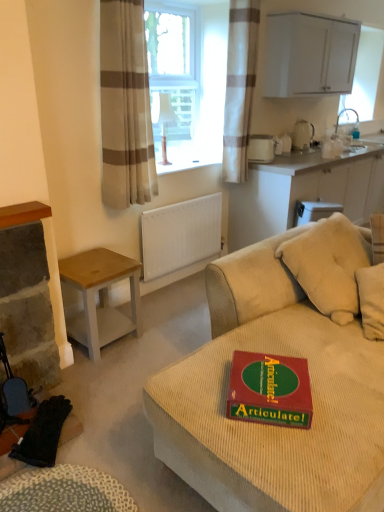
Identify the location of white glossy cabinet at upper right, which is the second cabinetry from bottom to top. The width and height of the screenshot is (384, 512). (309, 55).

Identify the location of beige striped curtain at upper center, marked as the 1th curtain in a front-to-back arrangement. This screenshot has height=512, width=384. (125, 106).

Describe the element at coordinates (239, 87) in the screenshot. The width and height of the screenshot is (384, 512). I see `beige striped curtain at upper right, the first curtain from the right` at that location.

Where is `white matte radiator at center`? white matte radiator at center is located at coordinates (180, 234).

Identify the location of silver metallic faucet at upper right. (344, 112).

Which point is more forward, (368, 411) or (314, 132)?

The point (368, 411) is closer to the camera.

In the image, is beige corduroy couch at center positioned in front of or behind white glossy kettle at upper right, the 2th appliance from the front?

Clearly, beige corduroy couch at center is in front of white glossy kettle at upper right, the 2th appliance from the front.

Is white glossy kettle at upper right, the 2th appliance when ordered from left to right, completely or partially inside beige corduroy couch at center?

No, white glossy kettle at upper right, the 2th appliance when ordered from left to right, is not surrounded by beige corduroy couch at center.

From the image's perspective, between light brown wood desk at left and silver metallic faucet at upper right, who is located below?

light brown wood desk at left.

Between light brown wood desk at left and silver metallic faucet at upper right, which one has larger size?

light brown wood desk at left is bigger.

Is there a large distance between light brown wood desk at left and silver metallic faucet at upper right?

light brown wood desk at left is far away from silver metallic faucet at upper right.

How distant is light brown wood desk at left from silver metallic faucet at upper right?

light brown wood desk at left and silver metallic faucet at upper right are 3.02 meters apart from each other.

Visually, is white glossy kettle at upper right, marked as the first appliance in a right-to-left arrangement, positioned to the left or to the right of beige corduroy couch at center?

Clearly, white glossy kettle at upper right, marked as the first appliance in a right-to-left arrangement, is on the right of beige corduroy couch at center in the image.

How far apart are white glossy kettle at upper right, marked as the first appliance in a right-to-left arrangement, and beige corduroy couch at center?

The distance of white glossy kettle at upper right, marked as the first appliance in a right-to-left arrangement, from beige corduroy couch at center is 8.93 feet.

Is white glossy kettle at upper right, acting as the first appliance starting from the back, not near beige corduroy couch at center?

Indeed, white glossy kettle at upper right, acting as the first appliance starting from the back, is not near beige corduroy couch at center.

Is beige corduroy couch at center inside white glossy kettle at upper right, the 2th appliance when ordered from left to right?

No, beige corduroy couch at center is not surrounded by white glossy kettle at upper right, the 2th appliance when ordered from left to right.

There is a light brown wood desk at left. Identify the location of the 2nd cabinetry above it (from a real-world perspective). This screenshot has width=384, height=512. (309, 55).

Is light brown wood desk at left not inside white glossy cabinet at upper right, which is the second cabinetry from bottom to top?

Yes.

Is light brown wood desk at left wider than white glossy cabinet at upper right, arranged as the first cabinetry when viewed from the top?

Yes.

How many degrees apart are the facing directions of light brown wood desk at left and white glossy cabinet at upper right, which is the second cabinetry from bottom to top?

The angular difference between light brown wood desk at left and white glossy cabinet at upper right, which is the second cabinetry from bottom to top, is 3.02 degrees.

From a real-world perspective, does beige corduroy couch at center sit lower than white matte cabinet at upper right, which ranks as the 2th cabinetry in top-to-bottom order?

No, from a real-world perspective, beige corduroy couch at center is not beneath white matte cabinet at upper right, which ranks as the 2th cabinetry in top-to-bottom order.

Between beige corduroy couch at center and white matte cabinet at upper right, which ranks as the 2th cabinetry in top-to-bottom order, which one is positioned in front?

beige corduroy couch at center.

Between beige corduroy couch at center and white matte cabinet at upper right, which ranks as the 2th cabinetry in top-to-bottom order, which one appears on the left side from the viewer's perspective?

Positioned to the left is beige corduroy couch at center.

Based on the photo, could you tell me if beige corduroy couch at center is turned towards white matte cabinet at upper right, which ranks as the 2th cabinetry in top-to-bottom order?

No, beige corduroy couch at center is not aimed at white matte cabinet at upper right, which ranks as the 2th cabinetry in top-to-bottom order.

Could you tell me if matte white lampshade at center is facing beige corduroy couch at center?

No.

This screenshot has width=384, height=512. Identify the location of lamp above the beige corduroy couch at center (from a real-world perspective). (164, 120).

How different are the orientations of matte white lampshade at center and beige corduroy couch at center in degrees?

matte white lampshade at center and beige corduroy couch at center are facing 91.2 degrees away from each other.

How far apart are beige striped curtain at upper center, the first curtain in the left-to-right sequence, and beige corduroy couch at center?

The distance of beige striped curtain at upper center, the first curtain in the left-to-right sequence, from beige corduroy couch at center is 4.42 feet.

Looking at this image, is beige striped curtain at upper center, marked as the 1th curtain in a front-to-back arrangement, bigger than beige corduroy couch at center?

No.

Which is in front, point (132, 26) or point (319, 337)?

The point (319, 337) is more forward.

At what (x,y) coordinates should I click in order to perform the action: click on curtain that is the 1st object located above the beige corduroy couch at center (from the image's perspective). Please return your answer as a coordinate pair (x, y). Looking at the image, I should click on tap(125, 106).

Where is `studio couch located on the left of white glossy kettle at upper right, acting as the first appliance starting from the back`? studio couch located on the left of white glossy kettle at upper right, acting as the first appliance starting from the back is located at coordinates (272, 425).

What are the coordinates of `desk that appears below the silver metallic faucet at upper right (from the image's perspective)` in the screenshot? It's located at (101, 297).

Estimate the real-world distances between objects in this image. Which object is closer to white matte radiator at center, white plastic container at upper center, placed as the first appliance when sorted from left to right, or white glossy cabinet at upper right, which is the second cabinetry from bottom to top?

The object closer to white matte radiator at center is white plastic container at upper center, placed as the first appliance when sorted from left to right.

When comparing their distances from beige striped curtain at upper right, arranged as the 1th curtain when viewed from the back, does white plastic container at upper center, marked as the second appliance in a right-to-left arrangement, or light brown wood desk at left seem further?

light brown wood desk at left lies further to beige striped curtain at upper right, arranged as the 1th curtain when viewed from the back, than the other object.

From the image, which object appears to be nearer to beige corduroy couch at center, silver metallic faucet at upper right or white glossy cabinet at upper right, which is the second cabinetry from bottom to top?

white glossy cabinet at upper right, which is the second cabinetry from bottom to top, lies closer to beige corduroy couch at center than the other object.

Considering their positions, is green cardboard game at center positioned further to white glossy cabinet at upper right, which is the second cabinetry from bottom to top, than matte white lampshade at center?

green cardboard game at center is further to white glossy cabinet at upper right, which is the second cabinetry from bottom to top.

Based on their spatial positions, is beige striped curtain at upper center, arranged as the 2th curtain when viewed from the back, or beige corduroy couch at center further from white glossy cabinet at upper right, which is the second cabinetry from bottom to top?

Among the two, beige corduroy couch at center is located further to white glossy cabinet at upper right, which is the second cabinetry from bottom to top.

Estimate the real-world distances between objects in this image. Which object is closer to matte white lampshade at center, silver metallic faucet at upper right or white plastic container at upper center, the 2th appliance in the back-to-front sequence?

The object closer to matte white lampshade at center is white plastic container at upper center, the 2th appliance in the back-to-front sequence.

Estimate the real-world distances between objects in this image. Which object is closer to white plastic container at upper center, placed as the first appliance when sorted from left to right, beige striped curtain at upper center, positioned as the second curtain in right-to-left order, or matte white lampshade at center?

matte white lampshade at center.

Estimate the real-world distances between objects in this image. Which object is closer to white plastic container at upper center, the 2th appliance in the back-to-front sequence, beige striped curtain at upper center, the first curtain in the left-to-right sequence, or green cardboard game at center?

beige striped curtain at upper center, the first curtain in the left-to-right sequence.

You are a GUI agent. You are given a task and a screenshot of the screen. Output one action in this format:
    pyautogui.click(x=<x>, y=<y>)
    Task: Click on the lamp between beige striped curtain at upper right, arranged as the second curtain when viewed from the front, and light brown wood desk at left vertically
    Image resolution: width=384 pixels, height=512 pixels.
    Given the screenshot: What is the action you would take?
    pyautogui.click(x=164, y=120)

I want to click on desk positioned between green cardboard game at center and white matte radiator at center from near to far, so click(x=101, y=297).

The image size is (384, 512). Find the location of `cabinetry between beige corduroy couch at center and white glossy cabinet at upper right, which is the second cabinetry from bottom to top, from front to back`. cabinetry between beige corduroy couch at center and white glossy cabinet at upper right, which is the second cabinetry from bottom to top, from front to back is located at coordinates (306, 189).

Locate an element on the screen. The height and width of the screenshot is (512, 384). radiator between beige striped curtain at upper right, arranged as the second curtain when viewed from the front, and light brown wood desk at left, in the vertical direction is located at coordinates (180, 234).